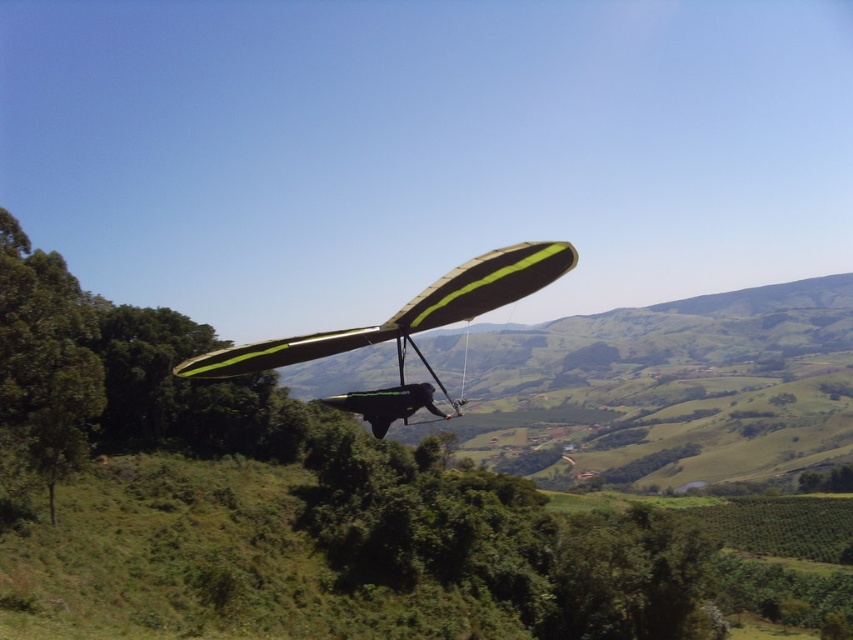
Between green leafy tree at left and green matte parachute at center, which one is positioned higher?

green matte parachute at center is higher up.

Is green leafy tree at left thinner than green matte parachute at center?

In fact, green leafy tree at left might be wider than green matte parachute at center.

Does point (71, 276) lie behind point (283, 356)?

Yes.

You are a GUI agent. You are given a task and a screenshot of the screen. Output one action in this format:
    pyautogui.click(x=<x>, y=<y>)
    Task: Click on the green leafy tree at left
    The image size is (853, 640).
    Given the screenshot: What is the action you would take?
    pyautogui.click(x=45, y=358)